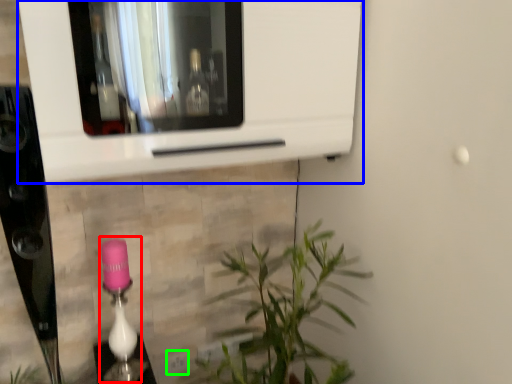
Question: Which is farther away from lamp (highlighted by a red box)? microwave (highlighted by a blue box) or electric outlet (highlighted by a green box)?

Choices:
 (A) microwave
 (B) electric outlet

Answer: (A)